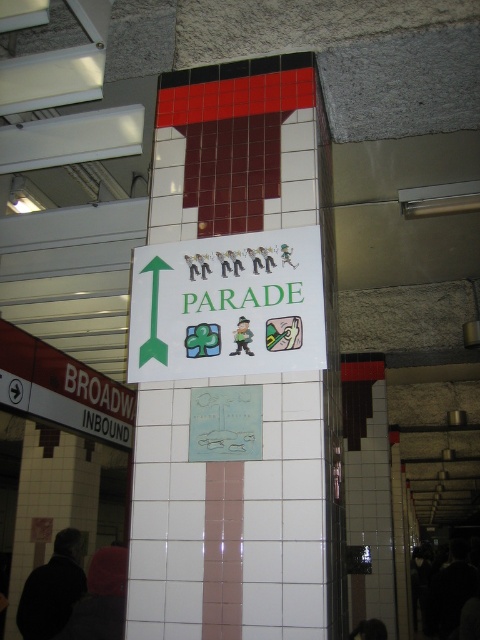
Question: Which object appears farthest from the camera in this image?

Choices:
 (A) black plastic text at lower left
 (B) white paper sign at center
 (C) white tile pillar at center
 (D) green paper sign at upper center

Answer: (A)

Question: Is white tile pillar at center positioned behind white paper sign at center?

Choices:
 (A) no
 (B) yes

Answer: (A)

Question: Which object appears farthest from the camera in this image?

Choices:
 (A) white tile pillar at center
 (B) black plastic text at lower left
 (C) white plastic text at left
 (D) green paper sign at upper center

Answer: (B)

Question: Does white paper sign at center have a smaller size compared to white plastic text at left?

Choices:
 (A) yes
 (B) no

Answer: (A)

Question: In this image, where is white paper sign at center located relative to white plastic text at left?

Choices:
 (A) above
 (B) below

Answer: (A)

Question: Which point is farther to the camera?

Choices:
 (A) (183, 291)
 (B) (126, 396)
 (C) (257, 216)

Answer: (B)